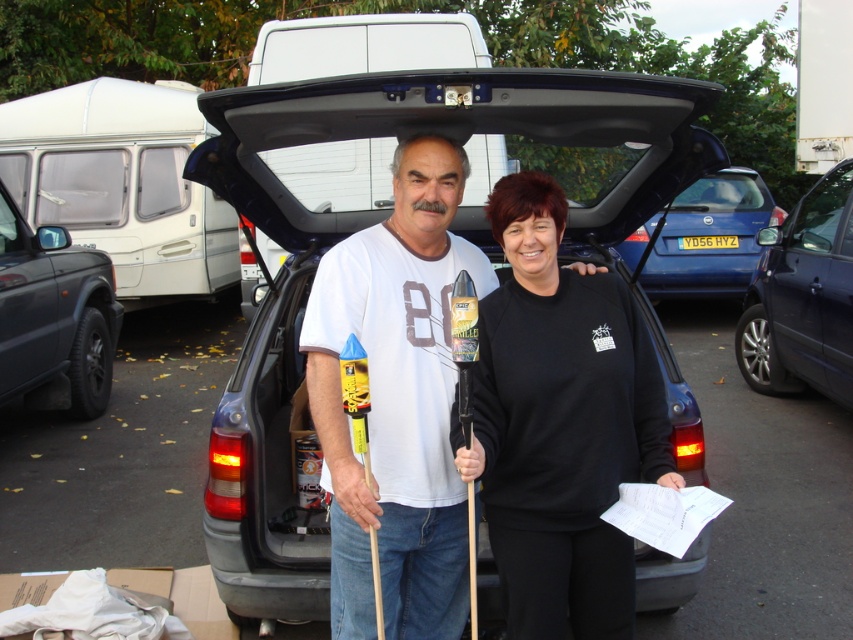
Question: Which object appears farthest from the camera in this image?

Choices:
 (A) white cotton t-shirt at center
 (B) white plastic van at upper left
 (C) matte black minivan at left
 (D) white matte van at center

Answer: (B)

Question: From the image, what is the correct spatial relationship of white matte van at center in relation to matte black minivan at left?

Choices:
 (A) below
 (B) above

Answer: (B)

Question: Is white plastic van at upper left positioned before blue metallic hatchback at center?

Choices:
 (A) no
 (B) yes

Answer: (B)

Question: Which point appears closest to the camera in this image?

Choices:
 (A) (549, 458)
 (B) (44, 282)
 (C) (167, 221)

Answer: (A)

Question: Is metallic gray van at center wider than blue metallic hatchback at center?

Choices:
 (A) yes
 (B) no

Answer: (B)

Question: Which of the following is the farthest from the observer?

Choices:
 (A) metallic gray van at center
 (B) black metallic car at right
 (C) matte black minivan at left

Answer: (C)